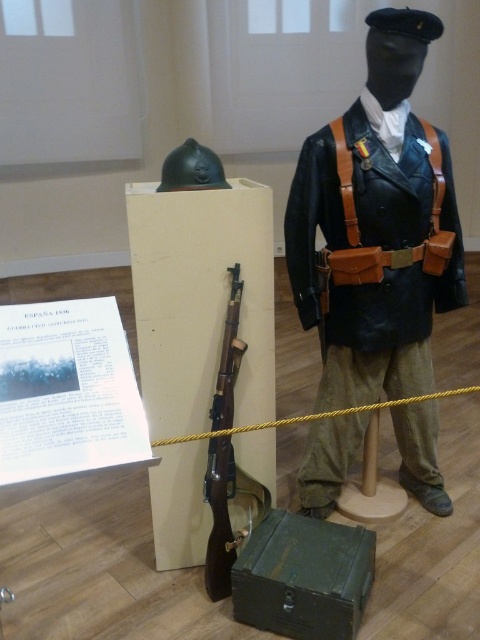
You are a visitor at the museum and want to take a photo of both the leather jacket at center and the wooden rifle at center. Which object should you focus on first to ensure both are in the frame?

You should focus on the wooden rifle at center first because the leather jacket at center is in front of it. By centering the rifle in the background, you can adjust the camera angle to include both objects without one blocking the other.